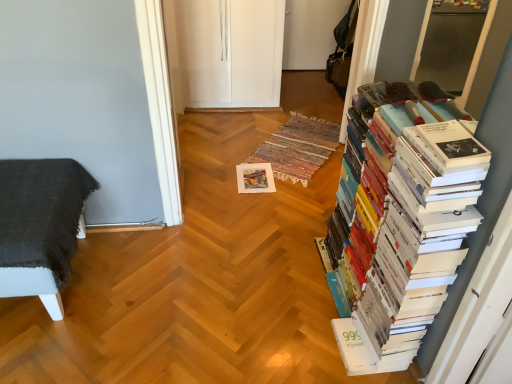
Identify the location of free area in between dark gray woven blanket on the left and white paper book at right. Image resolution: width=512 pixels, height=384 pixels. (205, 297).